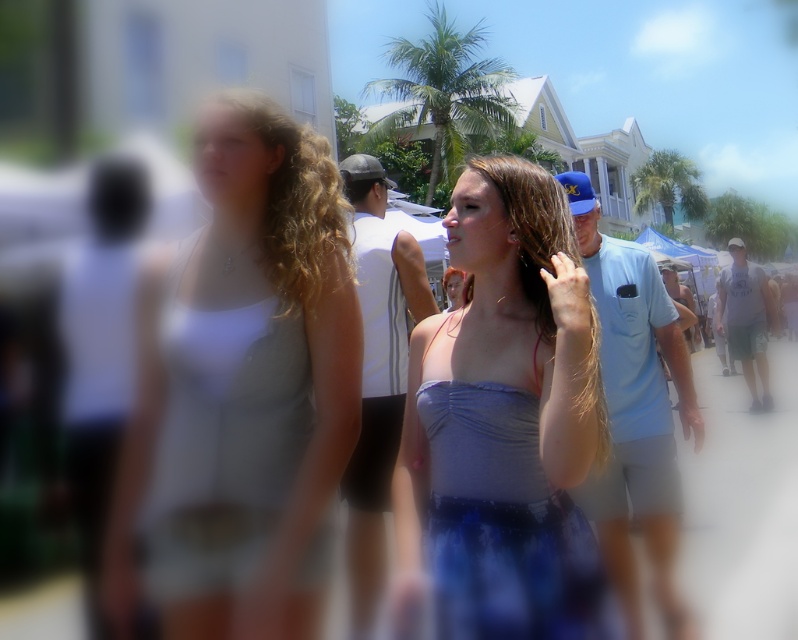
Who is taller, white fabric top at left or brown curly hair at center?

white fabric top at left is taller.

Between white fabric top at left and brown curly hair at center, which one has less height?

With less height is brown curly hair at center.

Describe the element at coordinates (239, 390) in the screenshot. I see `white fabric top at left` at that location.

Locate an element on the screen. white fabric top at left is located at coordinates (239, 390).

Does curly blonde hair at center have a smaller size compared to brown curly hair at center?

Incorrect, curly blonde hair at center is not smaller in size than brown curly hair at center.

Is curly blonde hair at center shorter than brown curly hair at center?

No, curly blonde hair at center is not shorter than brown curly hair at center.

Between point (314, 250) and point (362, 186), which one is positioned in front?

Positioned in front is point (314, 250).

Locate an element on the screen. The image size is (798, 640). curly blonde hair at center is located at coordinates (295, 200).

Is satin blue dress at center wider than blonde silky hair at center?

Indeed, satin blue dress at center has a greater width compared to blonde silky hair at center.

Is point (551, 490) closer to camera compared to point (538, 280)?

Yes.

Locate an element on the screen. This screenshot has height=640, width=798. satin blue dress at center is located at coordinates (502, 524).